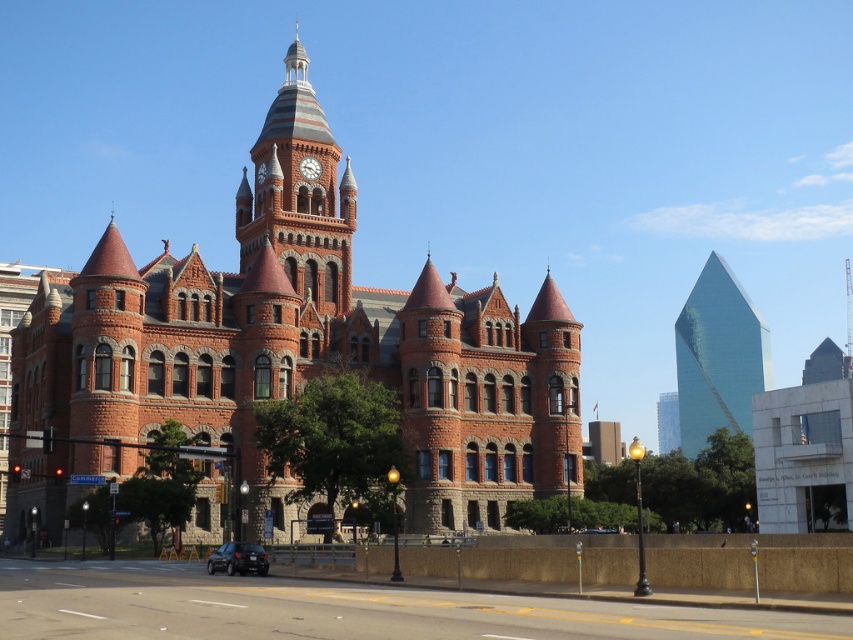
You are a pedestrian standing on the sidewalk in front of the historic building. You notice the glassy reflective skyscraper at right and the matte red clock at center. Which object is positioned farther to the east if the building faces north?

The glassy reflective skyscraper at right is to the right of matte red clock at center. Since the building faces north, the right side would be east. Therefore, the glassy reflective skyscraper at right is farther to the east.

You are a tourist standing in front of the grand historic building. You notice the red brick church at center and the red brick clock tower at center. Which one is positioned higher up in the image?

The red brick clock tower at center is positioned higher up because the red brick church at center is located below it.